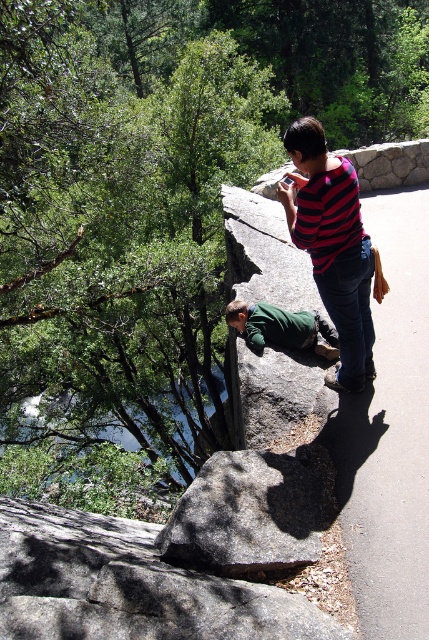
Can you confirm if gray granite rock at center is thinner than green fuzzy sweater at lower center?

No.

What do you see at coordinates (251, 513) in the screenshot? The image size is (429, 640). I see `gray granite rock at center` at bounding box center [251, 513].

You are a GUI agent. You are given a task and a screenshot of the screen. Output one action in this format:
    pyautogui.click(x=<x>, y=<y>)
    Task: Click on the gray granite rock at center
    The width and height of the screenshot is (429, 640).
    Given the screenshot: What is the action you would take?
    pyautogui.click(x=251, y=513)

Between point (310, 220) and point (254, 348), which one is positioned in front?

Point (310, 220)

Based on the photo, can you confirm if green cotton shirt at center is positioned below green fuzzy sweater at lower center?

No, green cotton shirt at center is not below green fuzzy sweater at lower center.

Does point (353, 214) lie behind point (271, 312)?

No, (353, 214) is closer to viewer.

Locate an element on the screen. The image size is (429, 640). green cotton shirt at center is located at coordinates (332, 244).

Can you confirm if gray granite rock at center is bigger than green cotton shirt at center?

Actually, gray granite rock at center might be smaller than green cotton shirt at center.

Does point (190, 560) lie in front of point (326, 268)?

Yes, it is.

Locate an element on the screen. Image resolution: width=429 pixels, height=640 pixels. gray granite rock at center is located at coordinates (251, 513).